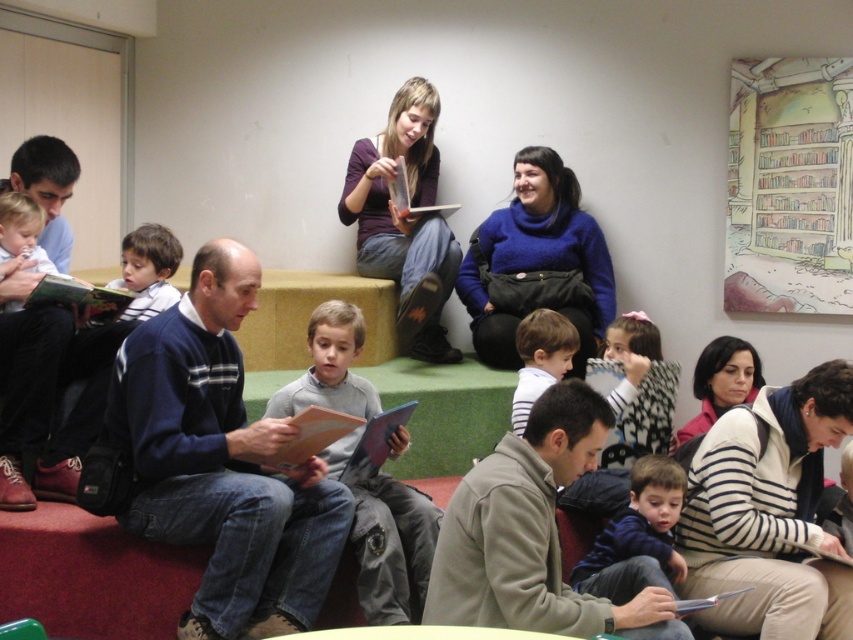
Does matte purple sweater at upper center have a lesser height compared to dark blue sweater at lower center?

In fact, matte purple sweater at upper center may be taller than dark blue sweater at lower center.

The image size is (853, 640). I want to click on matte purple sweater at upper center, so click(x=404, y=220).

Image resolution: width=853 pixels, height=640 pixels. What do you see at coordinates (404, 220) in the screenshot?
I see `matte purple sweater at upper center` at bounding box center [404, 220].

Find the location of a particular element. The width and height of the screenshot is (853, 640). matte purple sweater at upper center is located at coordinates (404, 220).

Does point (323, 317) lie behind point (397, 161)?

No, (323, 317) is in front of (397, 161).

You are a GUI agent. You are given a task and a screenshot of the screen. Output one action in this format:
    pyautogui.click(x=<x>, y=<y>)
    Task: Click on the gray matte sweater at center
    The image size is (853, 640).
    Given the screenshot: What is the action you would take?
    pyautogui.click(x=387, y=540)

Is gray fleece jacket at lower right in front of white striped shirt at center?

That is True.

Is gray fleece jacket at lower right taller than white striped shirt at center?

Yes.

Identify the location of gray fleece jacket at lower right. This screenshot has width=853, height=640. (534, 534).

Find the location of a particular element. This screenshot has width=853, height=640. gray fleece jacket at lower right is located at coordinates (534, 534).